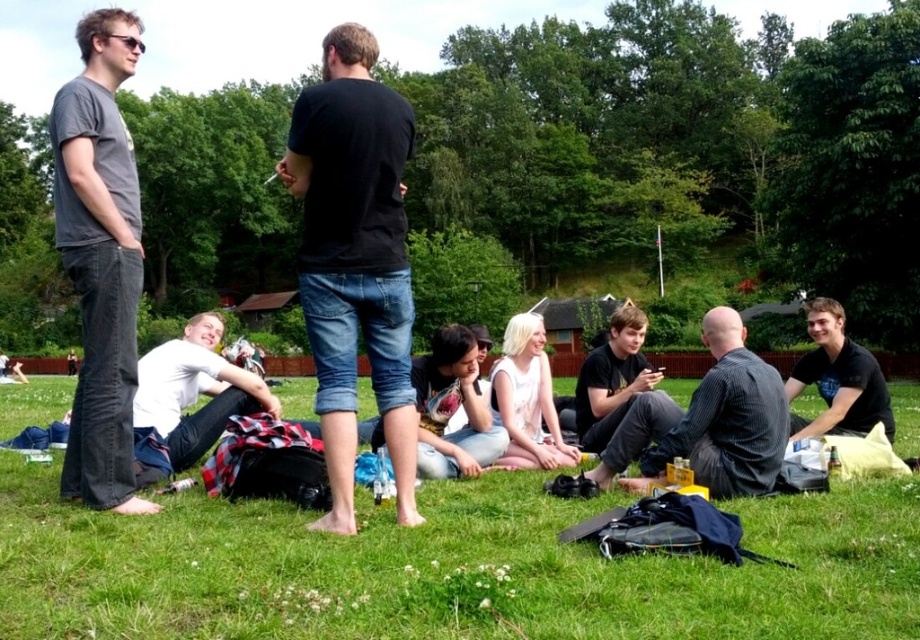
Question: Which object is farther from the camera taking this photo?

Choices:
 (A) denim shorts at center
 (B) black t-shirt at center

Answer: (A)

Question: Can you confirm if dark gray striped shirt at center is positioned below black cotton shirt at lower right?

Choices:
 (A) no
 (B) yes

Answer: (B)

Question: Does gray corduroy pants at left appear under dark gray striped shirt at center?

Choices:
 (A) yes
 (B) no

Answer: (B)

Question: Based on their relative distances, which object is nearer to the dark gray striped shirt at center?

Choices:
 (A) white cotton shirt at lower left
 (B) gray corduroy pants at left

Answer: (A)

Question: Does white cotton shirt at lower left have a lesser width compared to black cotton shirt at lower right?

Choices:
 (A) yes
 (B) no

Answer: (A)

Question: Among these points, which one is nearest to the camera?

Choices:
 (A) (755, 449)
 (B) (307, 278)

Answer: (B)